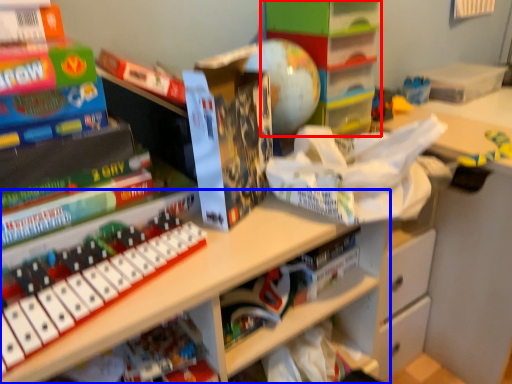
Question: Which of the following is the closest to the observer, shelf (highlighted by a red box) or shelf (highlighted by a blue box)?

Choices:
 (A) shelf
 (B) shelf

Answer: (B)